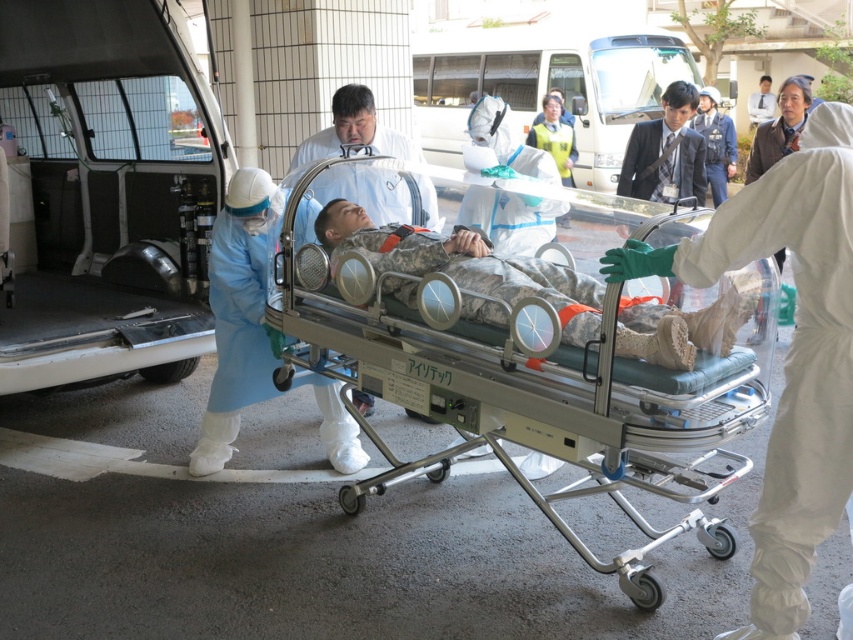
Question: Does silver metallic stretcher at center appear on the right side of camouflage fabric baby at center?

Choices:
 (A) yes
 (B) no

Answer: (A)

Question: Can you confirm if silver metallic stretcher at center is bigger than camouflage fabric baby at center?

Choices:
 (A) yes
 (B) no

Answer: (A)

Question: Which point is farther to the camera?

Choices:
 (A) pos(524,284)
 (B) pos(602,564)

Answer: (A)

Question: Which object is farther from the camera taking this photo?

Choices:
 (A) camouflage fabric baby at center
 (B) silver metallic stretcher at center

Answer: (A)

Question: Does silver metallic stretcher at center have a lesser width compared to camouflage fabric baby at center?

Choices:
 (A) yes
 (B) no

Answer: (B)